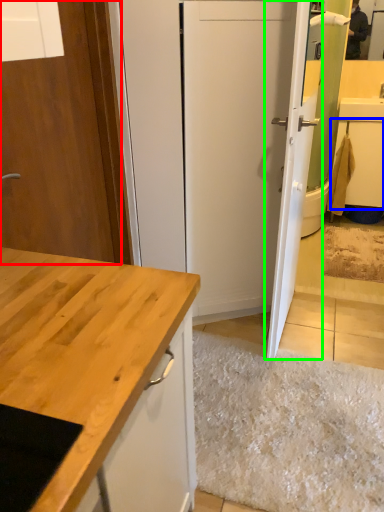
Question: Based on their relative distances, which object is farther from door (highlighted by a red box)? Choose from cabinetry (highlighted by a blue box) and door (highlighted by a green box).

Choices:
 (A) cabinetry
 (B) door

Answer: (A)